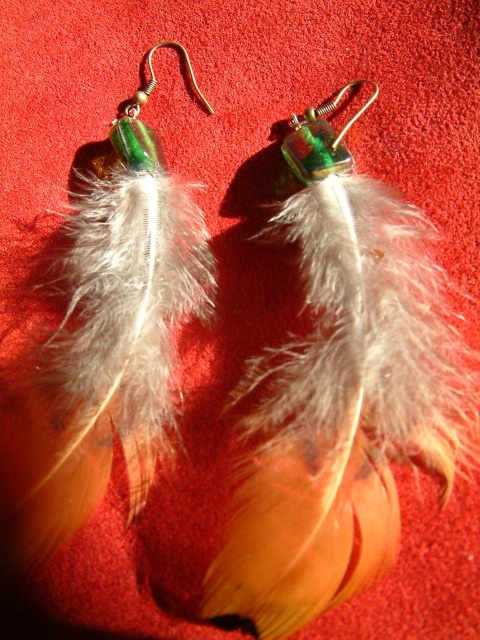
You are a jeweler examining the feather earrings at center and the green glass hook at center. Which of these two items is taller?

The feather earrings at center are taller than the green glass hook at center.

You are a jeweler who wants to place a small sticker on the feather earrings at center. According to the coordinates provided, where should you place the sticker to ensure it is exactly at the center of the earrings?

The sticker should be placed at the coordinates point (110, 339) to ensure it is exactly at the center of the feather earrings at center.

You are a jewelry designer trying to create a new pair of earrings. You have the feather earrings at center and the green glass hook at center in front of you. Which of these two items would you choose if you want to use the larger one as the base for your design?

The feather earrings at center is larger in size than the green glass hook at center, so you should choose the feather earrings at center as the base for your design.